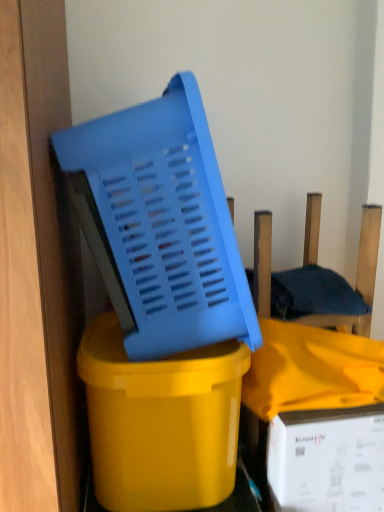
Question: Considering the relative positions of blue plastic chair at center and white cardboard box at lower right in the image provided, is blue plastic chair at center to the right of white cardboard box at lower right from the viewer's perspective?

Choices:
 (A) yes
 (B) no

Answer: (B)

Question: Is blue plastic chair at center outside of white cardboard box at lower right?

Choices:
 (A) yes
 (B) no

Answer: (A)

Question: From a real-world perspective, does blue plastic chair at center stand above white cardboard box at lower right?

Choices:
 (A) no
 (B) yes

Answer: (B)

Question: Considering the relative sizes of blue plastic chair at center and white cardboard box at lower right in the image provided, is blue plastic chair at center wider than white cardboard box at lower right?

Choices:
 (A) no
 (B) yes

Answer: (B)

Question: From the image's perspective, is blue plastic chair at center on white cardboard box at lower right?

Choices:
 (A) yes
 (B) no

Answer: (A)

Question: Would you say white cardboard box at lower right is inside or outside blue plastic chair at center?

Choices:
 (A) inside
 (B) outside

Answer: (B)

Question: From their relative heights in the image, would you say white cardboard box at lower right is taller or shorter than blue plastic chair at center?

Choices:
 (A) tall
 (B) short

Answer: (A)

Question: Is point (334, 462) positioned closer to the camera than point (268, 292)?

Choices:
 (A) closer
 (B) farther

Answer: (A)

Question: Considering the relative positions of white cardboard box at lower right and blue plastic chair at center in the image provided, is white cardboard box at lower right to the left or to the right of blue plastic chair at center?

Choices:
 (A) left
 (B) right

Answer: (B)

Question: Considering the positions of blue plastic basket at center and blue plastic chair at center in the image, is blue plastic basket at center taller or shorter than blue plastic chair at center?

Choices:
 (A) short
 (B) tall

Answer: (B)

Question: Relative to blue plastic chair at center, is blue plastic basket at center in front or behind?

Choices:
 (A) front
 (B) behind

Answer: (A)

Question: Is blue plastic basket at center inside the boundaries of blue plastic chair at center, or outside?

Choices:
 (A) outside
 (B) inside

Answer: (A)

Question: Looking at their shapes, would you say blue plastic basket at center is wider or thinner than blue plastic chair at center?

Choices:
 (A) thin
 (B) wide

Answer: (B)

Question: Considering the positions of yellow glossy plastic bucket at center and blue plastic chair at center in the image, is yellow glossy plastic bucket at center wider or thinner than blue plastic chair at center?

Choices:
 (A) thin
 (B) wide

Answer: (B)

Question: From the image's perspective, relative to blue plastic chair at center, is yellow glossy plastic bucket at center above or below?

Choices:
 (A) above
 (B) below

Answer: (B)